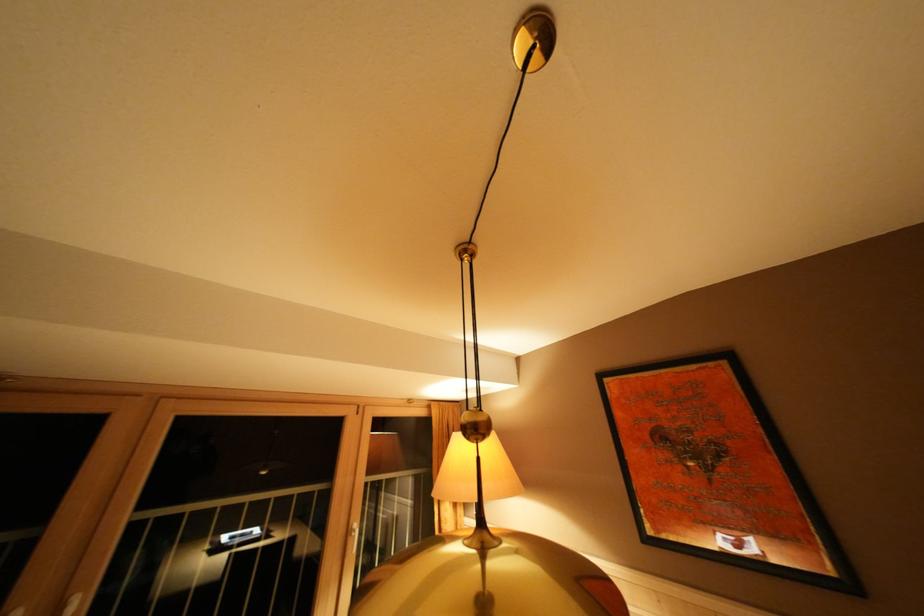
The height and width of the screenshot is (616, 924). Describe the element at coordinates (533, 39) in the screenshot. I see `a lamp adjustment handle` at that location.